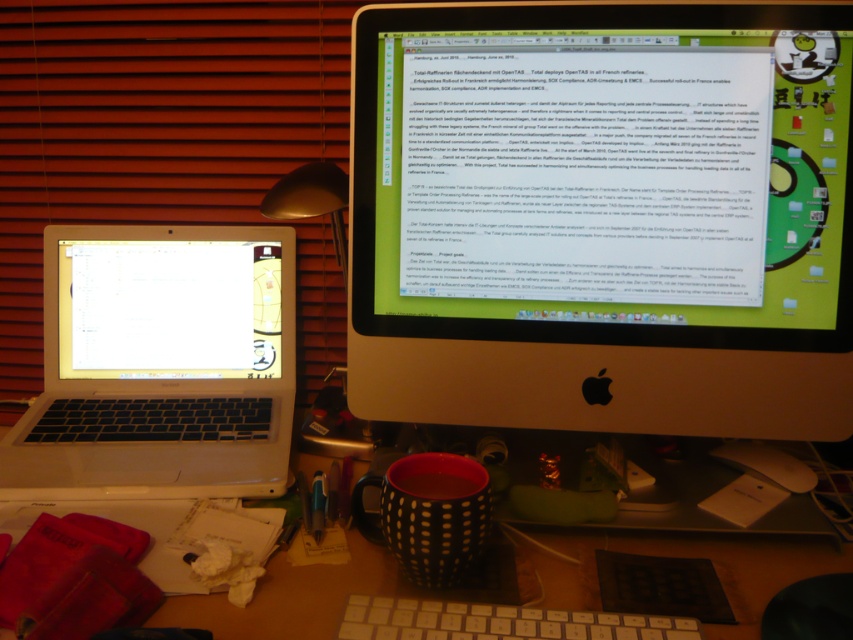
Question: Which of the following is the farthest from the observer?

Choices:
 (A) (115, 321)
 (B) (840, 20)
 (C) (648, 618)
 (D) (184, 356)

Answer: (D)

Question: Does white glossy laptop at left appear under black dotted mug at lower center?

Choices:
 (A) yes
 (B) no

Answer: (B)

Question: Which point appears closest to the camera in this image?

Choices:
 (A) (225, 256)
 (B) (746, 634)
 (C) (611, 388)

Answer: (B)

Question: Considering the real-world distances, which object is closest to the white matte laptop at left?

Choices:
 (A) white plastic keyboard at center
 (B) white glossy laptop at left
 (C) matte black monitor at center
 (D) black dotted mug at lower center

Answer: (B)

Question: Does matte black monitor at center have a larger size compared to white glossy laptop at left?

Choices:
 (A) yes
 (B) no

Answer: (A)

Question: Where is matte black monitor at center located in relation to white matte laptop at left in the image?

Choices:
 (A) above
 (B) below

Answer: (A)